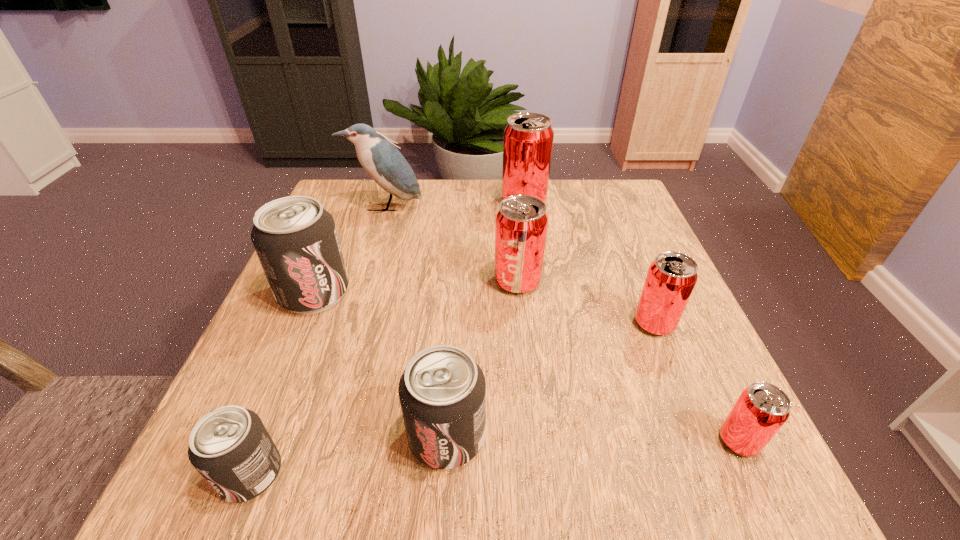
At what (x,y) coordinates should I click in order to perform the action: click on free space at the near right corner. Please return your answer as a coordinate pair (x, y). The width and height of the screenshot is (960, 540). Looking at the image, I should click on (783, 503).

This screenshot has width=960, height=540. Find the location of `free space between the bird and the third nearest red soda can`. free space between the bird and the third nearest red soda can is located at coordinates (451, 245).

Locate an element on the screen. This screenshot has width=960, height=540. empty space between the bird and the farthest black soda can is located at coordinates (349, 250).

The width and height of the screenshot is (960, 540). In order to click on empty space between the blue bird and the smallest black soda can in this screenshot , I will do `click(318, 341)`.

Locate an element on the screen. The image size is (960, 540). blank region between the smallest black soda can and the smallest red soda can is located at coordinates click(x=495, y=457).

You are a GUI agent. You are given a task and a screenshot of the screen. Output one action in this format:
    pyautogui.click(x=<x>, y=<y>)
    Task: Click on the free space between the farthest soda can and the bird
    
    Given the screenshot: What is the action you would take?
    pyautogui.click(x=454, y=205)

Identify the location of free spot between the third soda can from left to right and the farthest red soda can. This screenshot has width=960, height=540. (486, 319).

Find the location of a particular element. vacant space that is in between the third biggest red soda can and the third smallest red soda can is located at coordinates (586, 302).

Locate an element on the screen. This screenshot has height=540, width=960. vacant area between the smallest black soda can and the biggest black soda can is located at coordinates (282, 383).

Find the location of a particular element. empty space that is in between the nearest red soda can and the biggest black soda can is located at coordinates (527, 367).